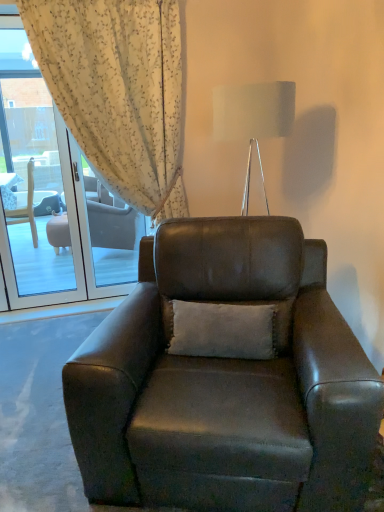
Question: From their relative heights in the image, would you say white floral fabric at upper left is taller or shorter than white soft cushion at center?

Choices:
 (A) short
 (B) tall

Answer: (B)

Question: Based on their positions, is white floral fabric at upper left located to the left or right of white soft cushion at center?

Choices:
 (A) left
 (B) right

Answer: (A)

Question: Which of these objects is positioned farthest from the metallic silver lamp at upper center?

Choices:
 (A) white floral fabric at upper left
 (B) white soft cushion at center
 (C) leather armchair at center

Answer: (C)

Question: Which of these objects is positioned farthest from the metallic silver lamp at upper center?

Choices:
 (A) leather armchair at center
 (B) white floral fabric at upper left
 (C) white soft cushion at center

Answer: (A)